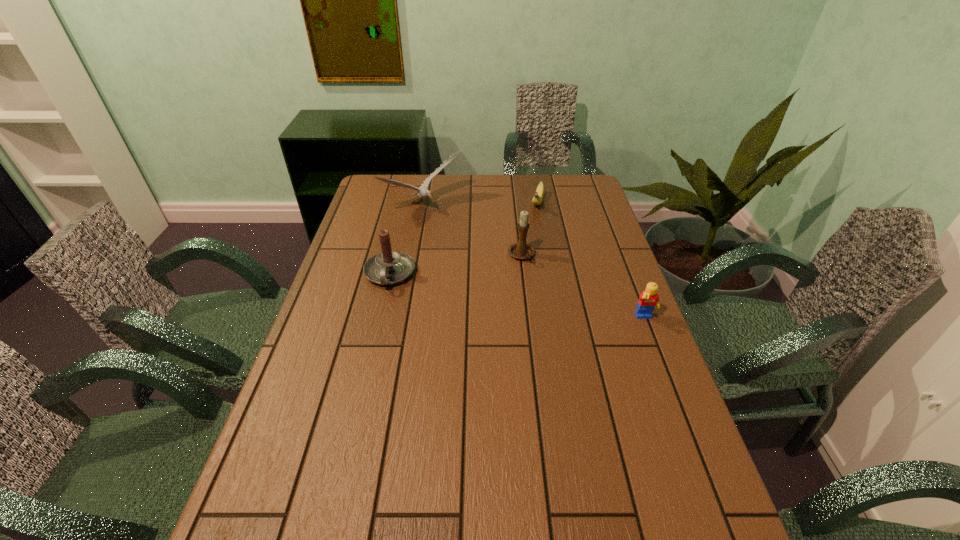
Where is `vacant position located 0.180m at the tip of the beak of the gull`? vacant position located 0.180m at the tip of the beak of the gull is located at coordinates (474, 245).

Identify the location of free spot located 0.210m at the tip of the beak of the gull. (479, 249).

The image size is (960, 540). What are the coordinates of `vacant space located on the side of the third object from left to right with the handle` in the screenshot? It's located at (550, 325).

Locate an element on the screen. free space located on the side of the third object from left to right with the handle is located at coordinates (564, 355).

Where is `vacant area situated 0.290m on the side of the third object from left to right with the handle`? Image resolution: width=960 pixels, height=540 pixels. vacant area situated 0.290m on the side of the third object from left to right with the handle is located at coordinates (554, 333).

Find the location of a particular element. free point located at the stem of the fourth object from left to right is located at coordinates 530,246.

Identify the location of vacant point located 0.230m at the stem of the fourth object from left to right. (528, 253).

Locate an element on the screen. vacant region located at the stem of the fourth object from left to right is located at coordinates (533, 235).

Find the location of a particular element. gull at the far edge is located at coordinates (423, 191).

I want to click on banana located at the far edge, so click(x=537, y=199).